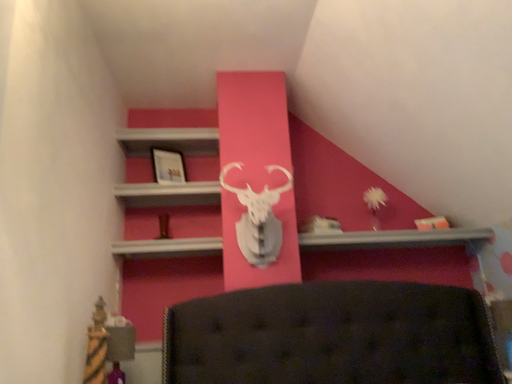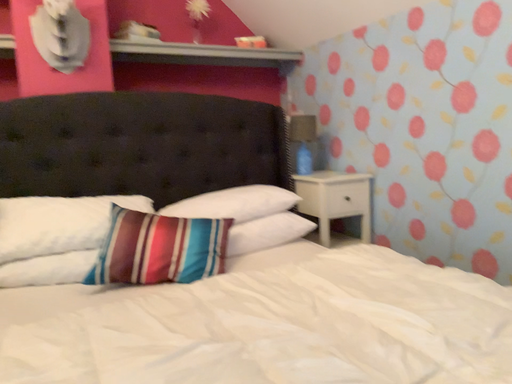
Question: How did the camera likely rotate when shooting the video?

Choices:
 (A) rotated left
 (B) rotated right

Answer: (B)